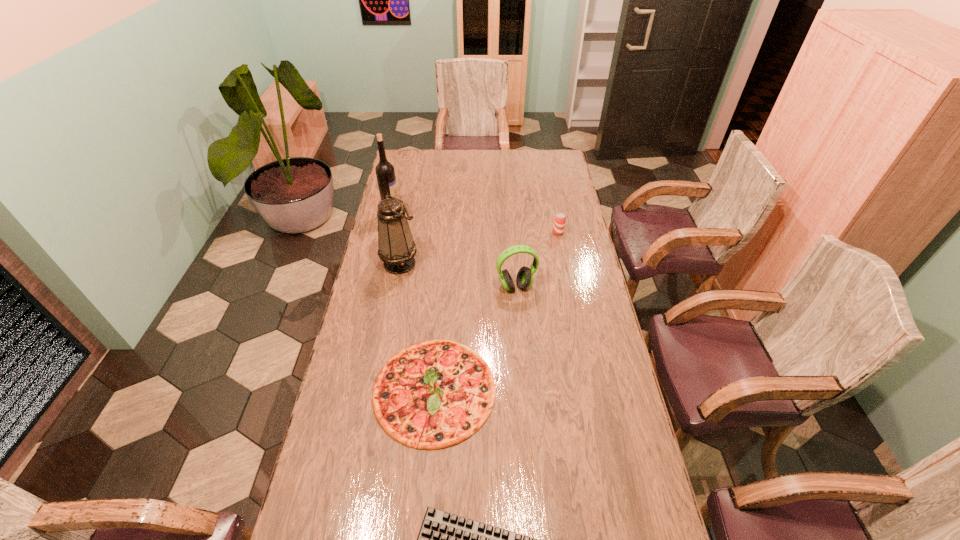
Find the location of a particular element. This screenshot has height=540, width=960. the tallest object is located at coordinates (385, 173).

Locate an element on the screen. Image resolution: width=960 pixels, height=540 pixels. the farthest object is located at coordinates (385, 173).

You are a GUI agent. You are given a task and a screenshot of the screen. Output one action in this format:
    pyautogui.click(x=<x>, y=<y>)
    Task: Click on the oil lamp
    This screenshot has height=540, width=960.
    Given the screenshot: What is the action you would take?
    pyautogui.click(x=396, y=248)

You are a GUI agent. You are given a task and a screenshot of the screen. Output one action in this format:
    pyautogui.click(x=<x>, y=<y>)
    Task: Click on the third tallest object
    Image resolution: width=960 pixels, height=540 pixels.
    Given the screenshot: What is the action you would take?
    pyautogui.click(x=525, y=276)

This screenshot has width=960, height=540. What are the coordinates of `the fifth nearest object` in the screenshot? It's located at (559, 220).

The height and width of the screenshot is (540, 960). I want to click on the third shortest object, so click(559, 220).

I want to click on the shortest object, so click(433, 394).

Identify the location of pizza. (433, 394).

The width and height of the screenshot is (960, 540). I want to click on vacant area situated 0.050m on the label of the tallest object, so click(x=413, y=216).

This screenshot has height=540, width=960. What are the coordinates of `vacant space located on the back of the second tallest object` in the screenshot? It's located at (411, 207).